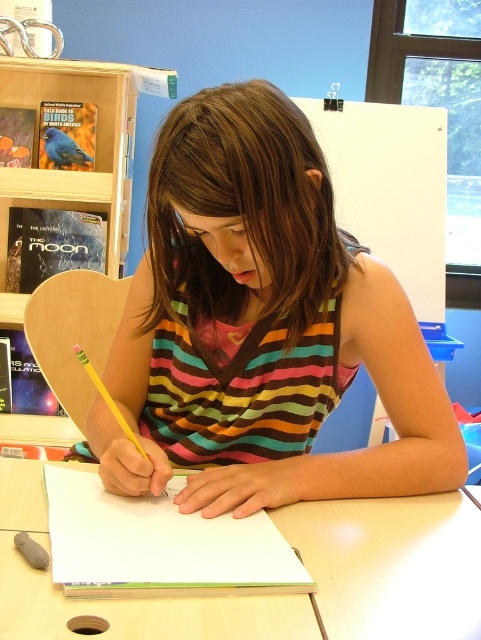
Can you confirm if white matte table at center is positioned to the right of wooden bookshelf at upper left?

Correct, you'll find white matte table at center to the right of wooden bookshelf at upper left.

Image resolution: width=481 pixels, height=640 pixels. What are the coordinates of `white matte table at center` in the screenshot? It's located at (392, 564).

How much distance is there between striped fabric shirt at center and white matte table at center?

A distance of 9.78 inches exists between striped fabric shirt at center and white matte table at center.

Which is below, striped fabric shirt at center or white matte table at center?

white matte table at center

You are a GUI agent. You are given a task and a screenshot of the screen. Output one action in this format:
    pyautogui.click(x=<x>, y=<y>)
    Task: Click on the striped fabric shirt at center
    This screenshot has height=640, width=481.
    Given the screenshot: What is the action you would take?
    pyautogui.click(x=261, y=326)

Can you confirm if striped fabric shirt at center is positioned above wooden bookshelf at upper left?

No, striped fabric shirt at center is not above wooden bookshelf at upper left.

Does striped fabric shirt at center have a lesser height compared to wooden bookshelf at upper left?

Correct, striped fabric shirt at center is not as tall as wooden bookshelf at upper left.

Locate an element on the screen. The width and height of the screenshot is (481, 640). striped fabric shirt at center is located at coordinates (261, 326).

The width and height of the screenshot is (481, 640). Identify the location of striped fabric shirt at center. (261, 326).